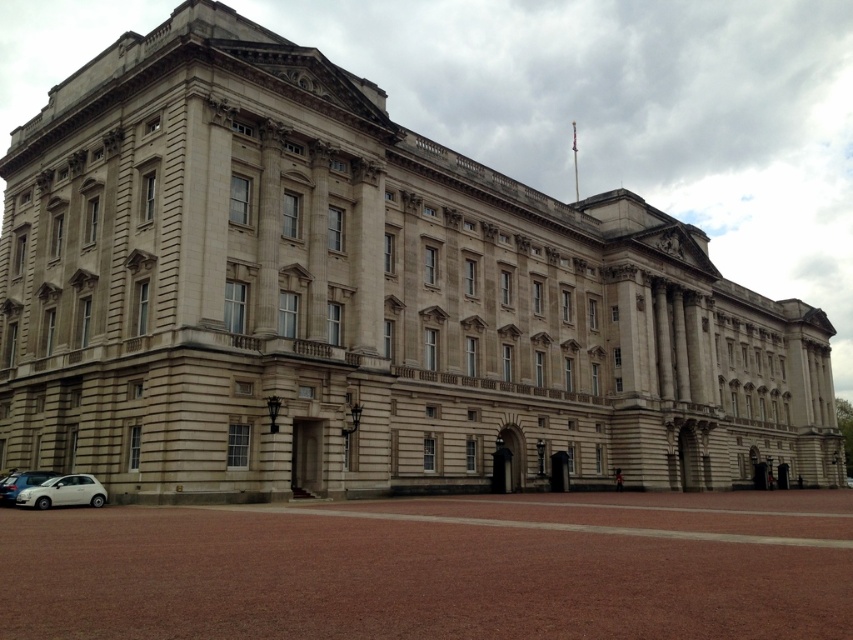
In the scene shown: You are a tourist standing in front of the grand neoclassical building, which has a flagpole on the roof. You see two cars at the lower left corner of the image. Which car is nearer to you, the white matte car at lower left or the silver metallic car at lower left?

The white matte car at lower left is closer to the viewer than the silver metallic car at lower left.

You are a tour guide explaining the vehicles parked near the grand neoclassical building. Which car is shorter between the white matte car at lower left and the silver metallic car at lower left?

The white matte car at lower left is not as tall as the silver metallic car at lower left, so the white matte car at lower left is shorter.